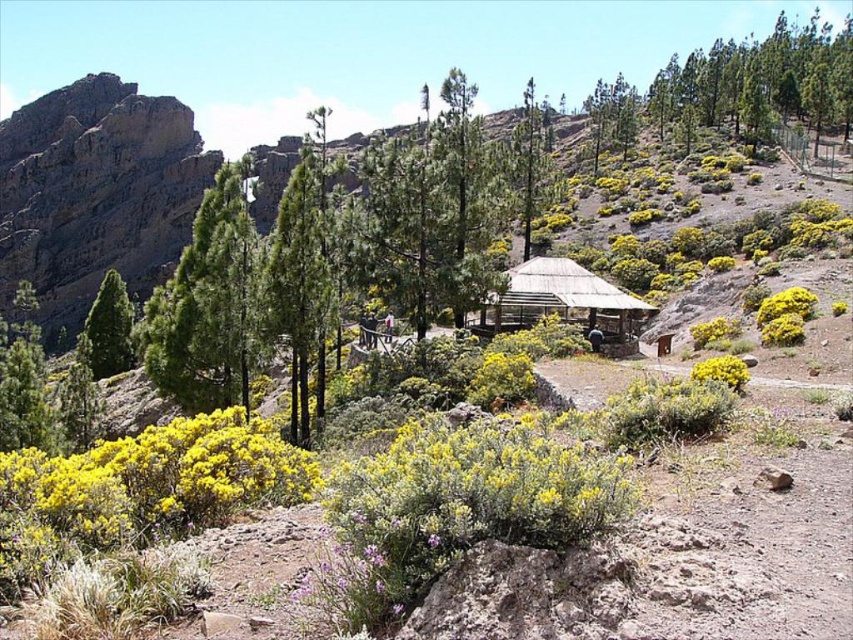
Question: Does green textured tree at center-left have a greater width compared to yellow fuzzy bush at center?

Choices:
 (A) no
 (B) yes

Answer: (B)

Question: Which object is the farthest from the green matte tree at center?

Choices:
 (A) wooden thatched hut at center
 (B) green textured trees at upper right
 (C) green textured tree at center-left
 (D) yellow fuzzy bush at center

Answer: (B)

Question: Does yellow fuzzy bush at center have a larger size compared to yellow matte flower at lower right?

Choices:
 (A) no
 (B) yes

Answer: (A)

Question: Estimate the real-world distances between objects in this image. Which object is closer to the yellow matte flower at lower right?

Choices:
 (A) green matte tree at center
 (B) green textured trees at upper right
 (C) yellow matte flower at center
 (D) yellow fuzzy bush at center

Answer: (D)

Question: Can you confirm if green textured tree at center-left is positioned to the right of yellow matte flower at center?

Choices:
 (A) yes
 (B) no

Answer: (B)

Question: Which point is farther to the camera?

Choices:
 (A) (735, 390)
 (B) (807, 310)
 (C) (194, 342)

Answer: (B)